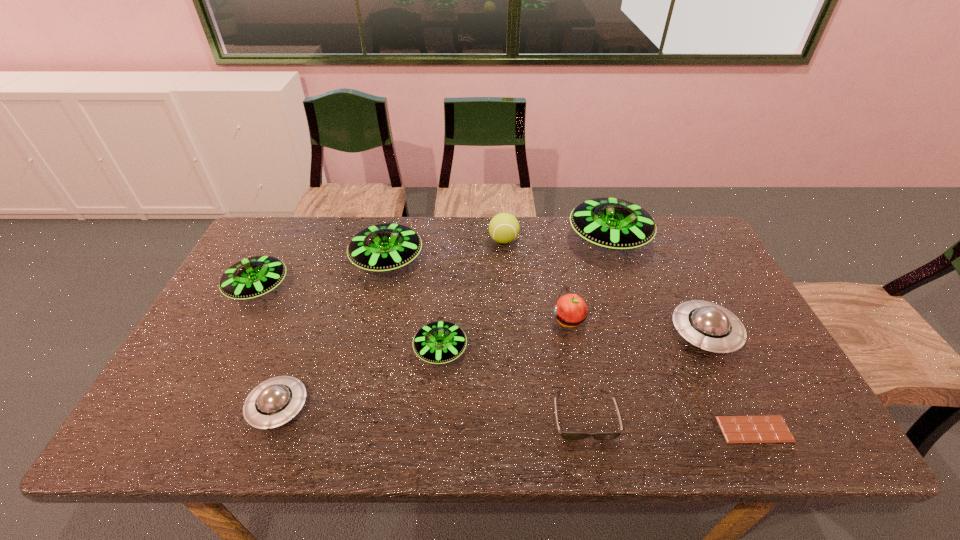
The width and height of the screenshot is (960, 540). Find the location of `chocolate bar present at the near edge`. chocolate bar present at the near edge is located at coordinates (768, 428).

Find the location of `object located in the left edge section of the desktop`. object located in the left edge section of the desktop is located at coordinates (253, 277).

The height and width of the screenshot is (540, 960). Identify the location of saucer that is positioned at the right edge. (704, 324).

Image resolution: width=960 pixels, height=540 pixels. I want to click on chocolate bar present at the right edge, so click(768, 428).

Locate an element on the screen. object that is at the near right corner is located at coordinates (768, 428).

At what (x,y) coordinates should I click in order to perform the action: click on vacant space at the far edge of the desktop. Please return your answer as a coordinate pair (x, y). Looking at the image, I should click on (536, 253).

Identify the location of vacant point at the near edge. The image size is (960, 540). (420, 431).

In the image, there is a desktop. Where is `vacant area at the left edge`? This screenshot has width=960, height=540. vacant area at the left edge is located at coordinates (220, 350).

You are a GUI agent. You are given a task and a screenshot of the screen. Output one action in this format:
    pyautogui.click(x=<x>, y=<y>)
    Task: Click on the free space at the far left corner of the desktop
    This screenshot has width=960, height=540.
    Given the screenshot: What is the action you would take?
    pyautogui.click(x=259, y=244)

You are a GUI agent. You are given a task and a screenshot of the screen. Output one action in this format:
    pyautogui.click(x=<x>, y=<y>)
    Task: Click on the free space at the near left corner of the desktop
    
    Given the screenshot: What is the action you would take?
    pyautogui.click(x=199, y=421)